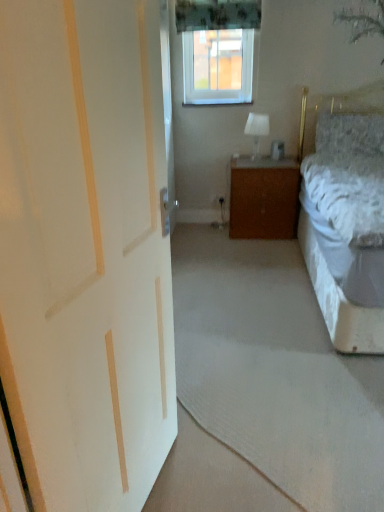
Question: Considering the relative sizes of fluffy gray pillow at upper right and white painted wood door at left in the image provided, is fluffy gray pillow at upper right bigger than white painted wood door at left?

Choices:
 (A) no
 (B) yes

Answer: (A)

Question: Is fluffy gray pillow at upper right thinner than white painted wood door at left?

Choices:
 (A) no
 (B) yes

Answer: (A)

Question: From a real-world perspective, is fluffy gray pillow at upper right positioned under white painted wood door at left based on gravity?

Choices:
 (A) yes
 (B) no

Answer: (B)

Question: Is white painted wood door at left surrounded by fluffy gray pillow at upper right?

Choices:
 (A) yes
 (B) no

Answer: (B)

Question: Can you confirm if fluffy gray pillow at upper right is positioned to the left of white painted wood door at left?

Choices:
 (A) no
 (B) yes

Answer: (A)

Question: From the image's perspective, is fluffy gray pillow at upper right on white painted wood door at left?

Choices:
 (A) no
 (B) yes

Answer: (B)

Question: Is wooden cabinet at center behind clear plastic window screen at upper center?

Choices:
 (A) yes
 (B) no

Answer: (B)

Question: Are wooden cabinet at center and clear plastic window screen at upper center far apart?

Choices:
 (A) no
 (B) yes

Answer: (B)

Question: From a real-world perspective, is wooden cabinet at center located higher than clear plastic window screen at upper center?

Choices:
 (A) yes
 (B) no

Answer: (B)

Question: Does wooden cabinet at center have a greater height compared to clear plastic window screen at upper center?

Choices:
 (A) no
 (B) yes

Answer: (B)

Question: From the image's perspective, is wooden cabinet at center above clear plastic window screen at upper center?

Choices:
 (A) no
 (B) yes

Answer: (A)

Question: Is clear plastic window screen at upper center at the back of wooden cabinet at center?

Choices:
 (A) no
 (B) yes

Answer: (A)

Question: Is white painted wood door at left with wooden cabinet at center?

Choices:
 (A) yes
 (B) no

Answer: (B)